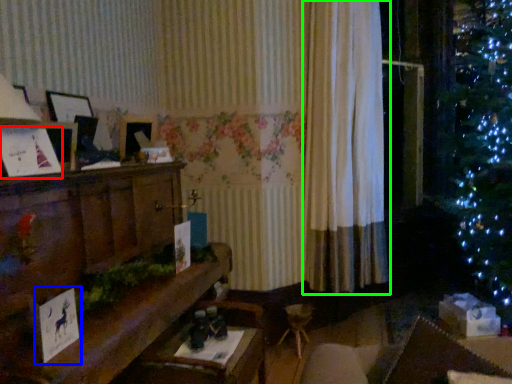
Question: Which object is the closest to the christmas card (highlighted by a red box)? Choose among these: christmas card (highlighted by a blue box) or curtain (highlighted by a green box).

Choices:
 (A) christmas card
 (B) curtain

Answer: (A)